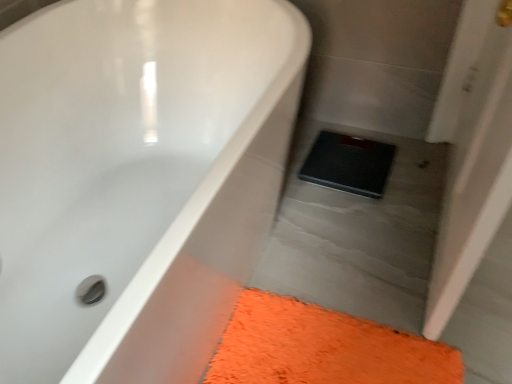
Question: Does orange shaggy bath mat at lower right appear on the right side of white glossy bathtub at upper left?

Choices:
 (A) yes
 (B) no

Answer: (A)

Question: Considering the relative sizes of orange shaggy bath mat at lower right and white glossy bathtub at upper left in the image provided, is orange shaggy bath mat at lower right wider than white glossy bathtub at upper left?

Choices:
 (A) yes
 (B) no

Answer: (B)

Question: Can we say orange shaggy bath mat at lower right lies outside white glossy bathtub at upper left?

Choices:
 (A) no
 (B) yes

Answer: (B)

Question: Is orange shaggy bath mat at lower right facing away from white glossy bathtub at upper left?

Choices:
 (A) no
 (B) yes

Answer: (A)

Question: From the image's perspective, would you say orange shaggy bath mat at lower right is shown under white glossy bathtub at upper left?

Choices:
 (A) no
 (B) yes

Answer: (B)

Question: In terms of width, does white glossy bathtub at upper left look wider or thinner when compared to orange shaggy bath mat at lower right?

Choices:
 (A) wide
 (B) thin

Answer: (A)

Question: From the image's perspective, is white glossy bathtub at upper left above or below orange shaggy bath mat at lower right?

Choices:
 (A) above
 (B) below

Answer: (A)

Question: Is white glossy bathtub at upper left in front of or behind orange shaggy bath mat at lower right in the image?

Choices:
 (A) behind
 (B) front

Answer: (B)

Question: Is point tap(71, 107) closer or farther from the camera than point tap(307, 365)?

Choices:
 (A) farther
 (B) closer

Answer: (A)

Question: In terms of width, does white glossy bathtub at upper left look wider or thinner when compared to black rubber scale at center?

Choices:
 (A) wide
 (B) thin

Answer: (A)

Question: Is white glossy bathtub at upper left taller or shorter than black rubber scale at center?

Choices:
 (A) short
 (B) tall

Answer: (B)

Question: Which is correct: white glossy bathtub at upper left is inside black rubber scale at center, or outside of it?

Choices:
 (A) outside
 (B) inside

Answer: (A)

Question: From the image's perspective, is white glossy bathtub at upper left above or below black rubber scale at center?

Choices:
 (A) below
 (B) above

Answer: (A)

Question: From a real-world perspective, is orange shaggy bath mat at lower right physically located above or below black rubber scale at center?

Choices:
 (A) below
 (B) above

Answer: (A)

Question: From the image's perspective, is orange shaggy bath mat at lower right above or below black rubber scale at center?

Choices:
 (A) above
 (B) below

Answer: (B)